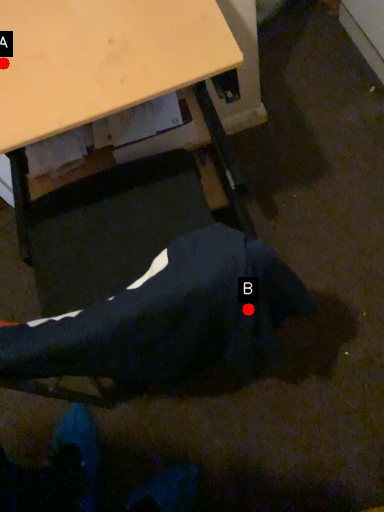
Question: Two points are circled on the image, labeled by A and B beside each circle. Among these points, which one is nearest to the camera?

Choices:
 (A) A is closer
 (B) B is closer

Answer: (B)